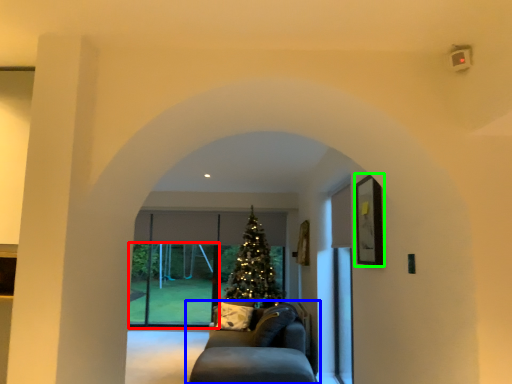
Question: Which is farther away from glass door (highlighted by a red box)? studio couch (highlighted by a blue box) or picture frame (highlighted by a green box)?

Choices:
 (A) studio couch
 (B) picture frame

Answer: (B)